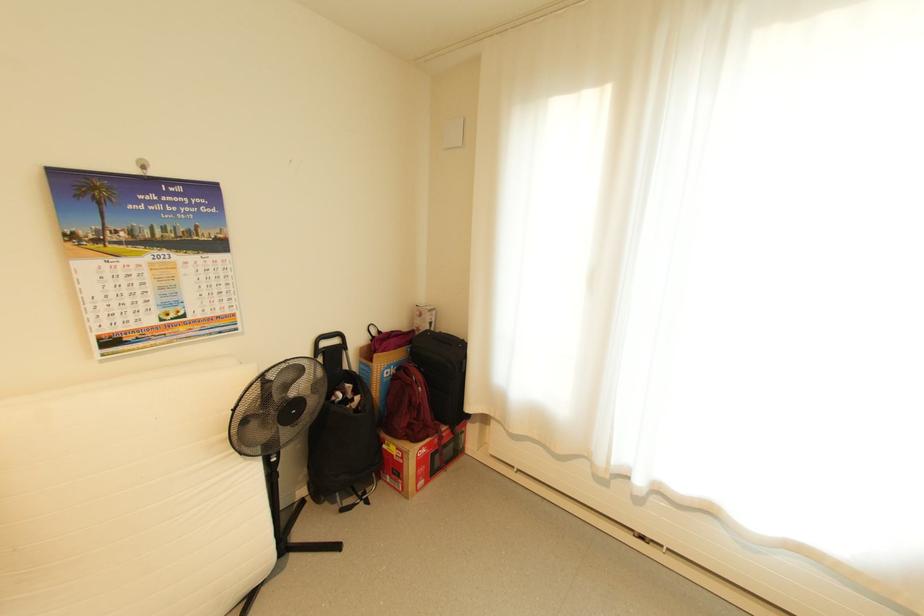
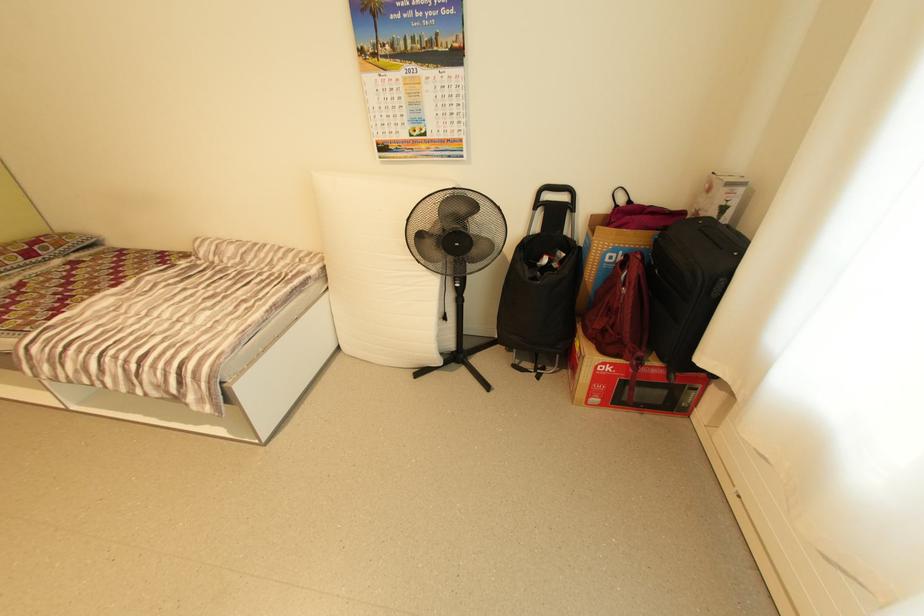
Find the pixel in the second image that matches (381,334) in the first image.

(628, 201)